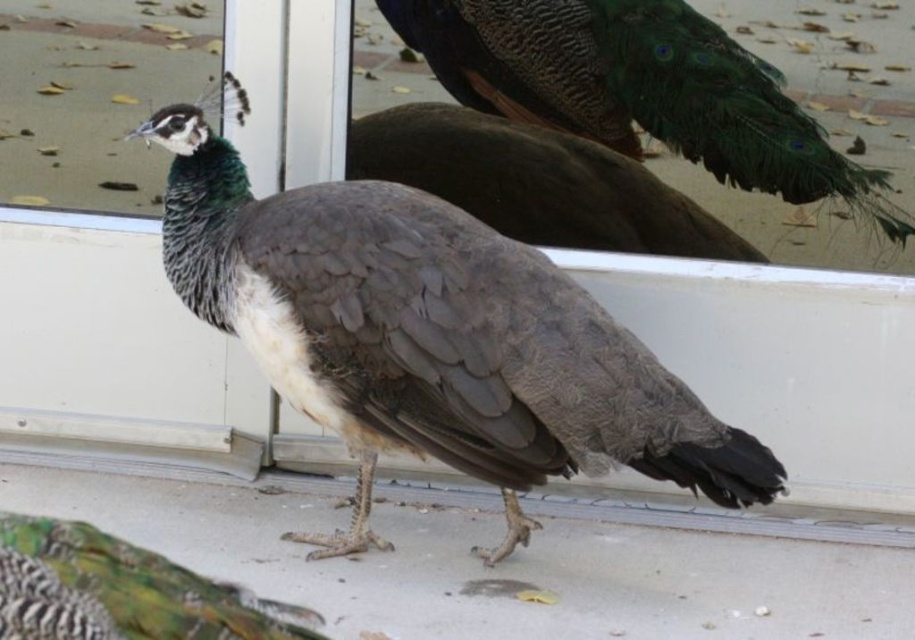
You are an interior designer assessing the placement of a peacock statue in a room with a reflective surface. You see the shiny green peacock at center and the green iridescent feathers at center. Which object is closer to you?

The shiny green peacock at center is closer to you than the green iridescent feathers at center.

You are a photographer trying to capture the shiny green peacock at center and the green iridescent feathers at center in a single shot. The camera you are using has a maximum focus range of 2.00 meters. Can you focus on both subjects simultaneously?

The shiny green peacock at center is 2.00 meters away from the green iridescent feathers at center. Since the camera can focus up to 2.00 meters, both subjects are within the focus range and can be captured in focus simultaneously.

You are standing in a room with a reflective surface. You see a peacock with dark gray feathers at center and a shiny green peacock at center in the reflection. Which one is closer to the reflective surface?

The dark gray feathers at center is closer to the reflective surface because it is located below the shiny green peacock at center, which is in the reflection.